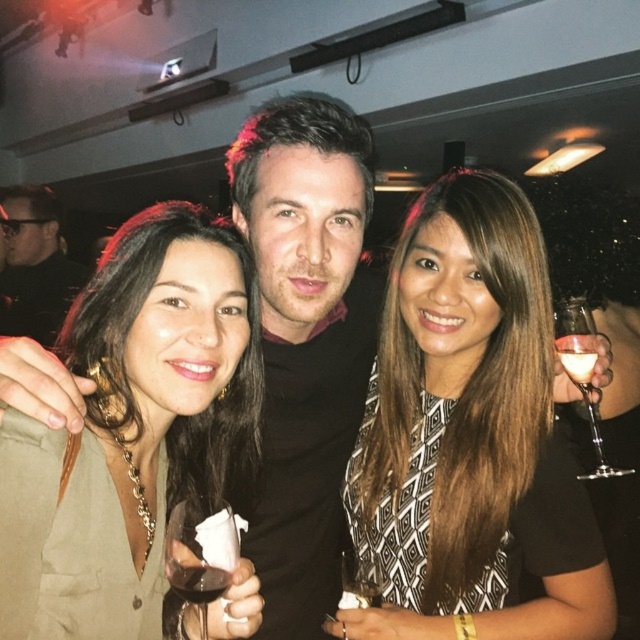
Question: Which of the following is the farthest from the observer?

Choices:
 (A) black and white dress at center
 (B) clear glass wine at center
 (C) black matte jacket at upper left

Answer: (C)

Question: Does transparent plastic wine glass at lower center have a lesser width compared to clear glass wine glass at right?

Choices:
 (A) yes
 (B) no

Answer: (A)

Question: In this image, where is clear glass wine at center located relative to translucent glass wine at center?

Choices:
 (A) above
 (B) below

Answer: (B)

Question: Which of the following is the closest to the observer?

Choices:
 (A) (177, 593)
 (B) (180, 483)
 (C) (576, 371)

Answer: (A)

Question: Which point appears farthest from the camera in this image?

Choices:
 (A) (349, 572)
 (B) (554, 545)

Answer: (A)

Question: Can you confirm if black and white dress at center is positioned below transparent plastic wine glass at lower center?

Choices:
 (A) no
 (B) yes

Answer: (A)